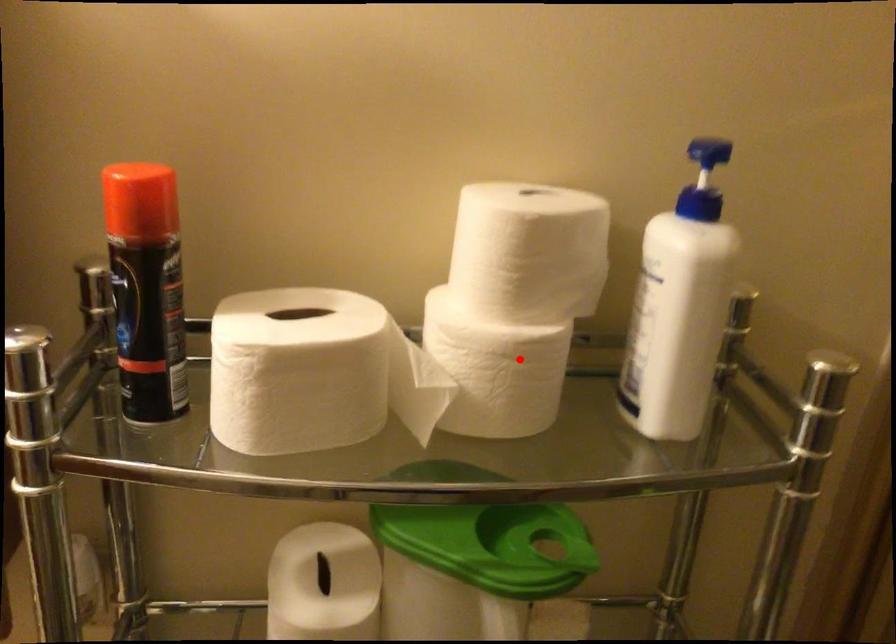
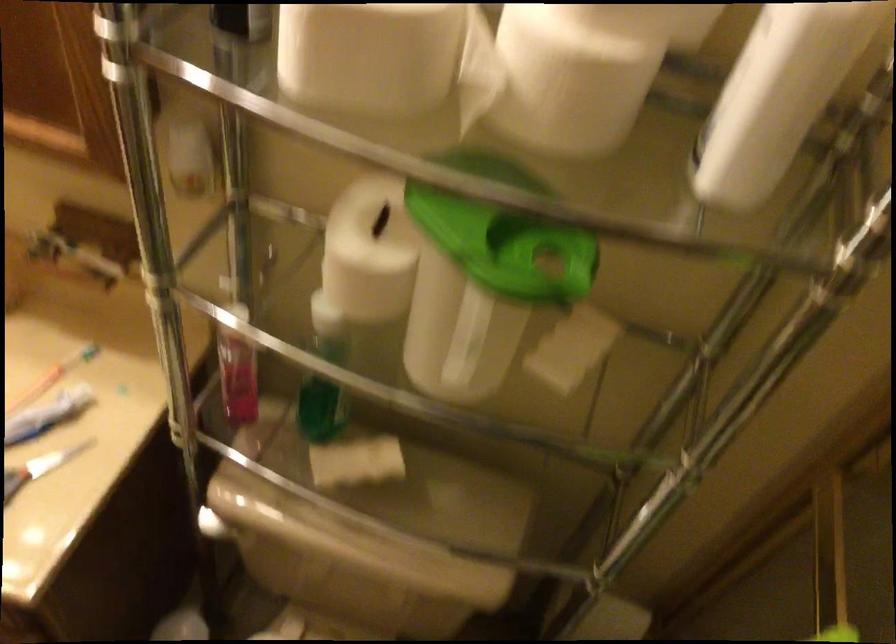
Locate, in the second image, the point that corresponds to the highlighted location in the first image.

(575, 73)